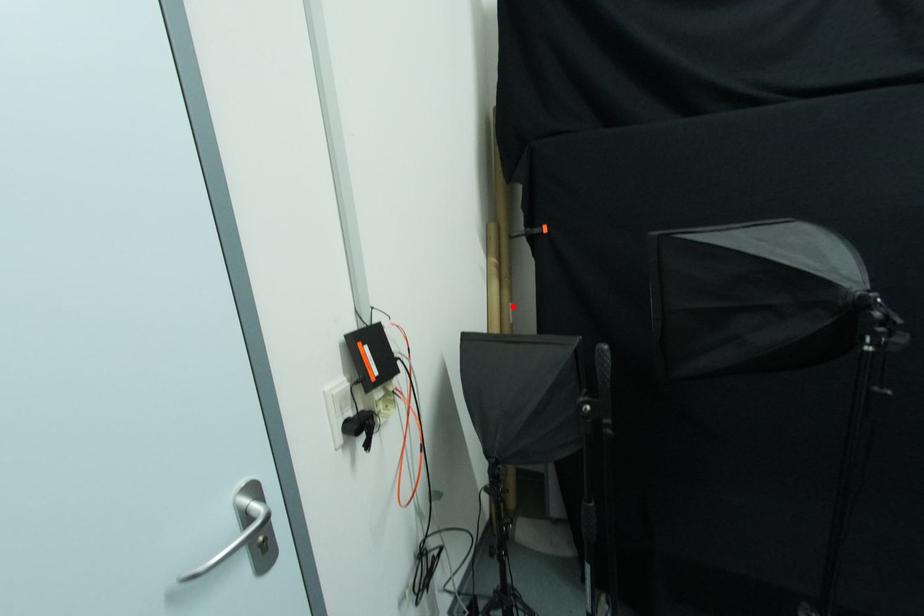
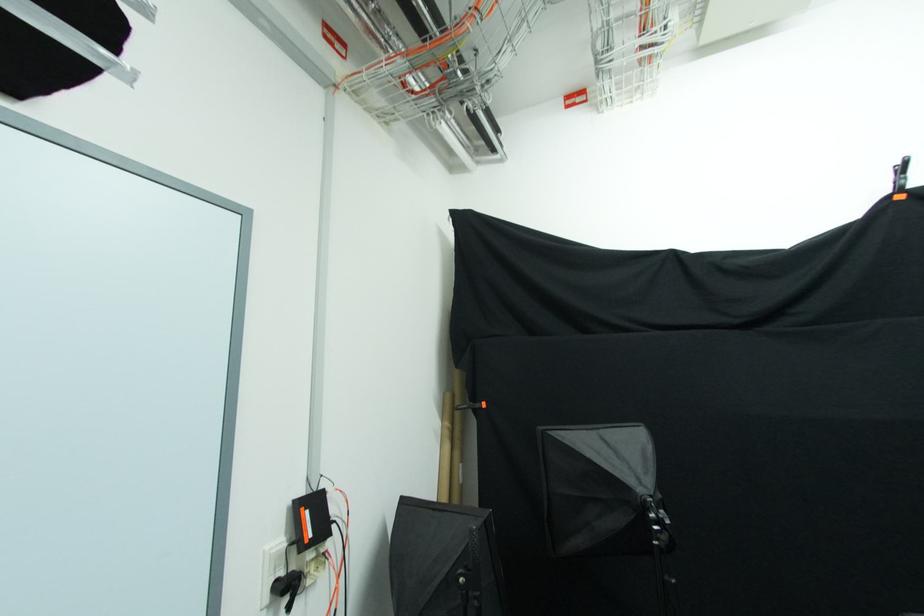
Find the pixel in the second image that matches the highlighted location in the first image.

(462, 468)